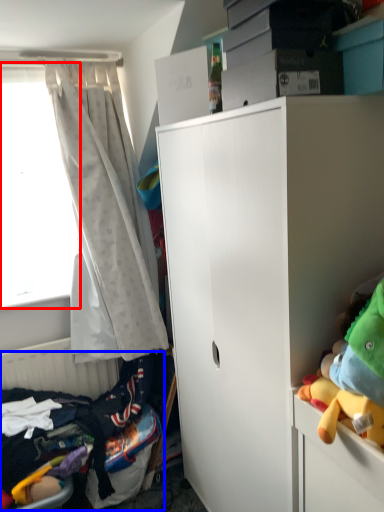
Question: Which object appears farthest to the camera in this image, window screen (highlighted by a red box) or bed (highlighted by a blue box)?

Choices:
 (A) window screen
 (B) bed

Answer: (A)